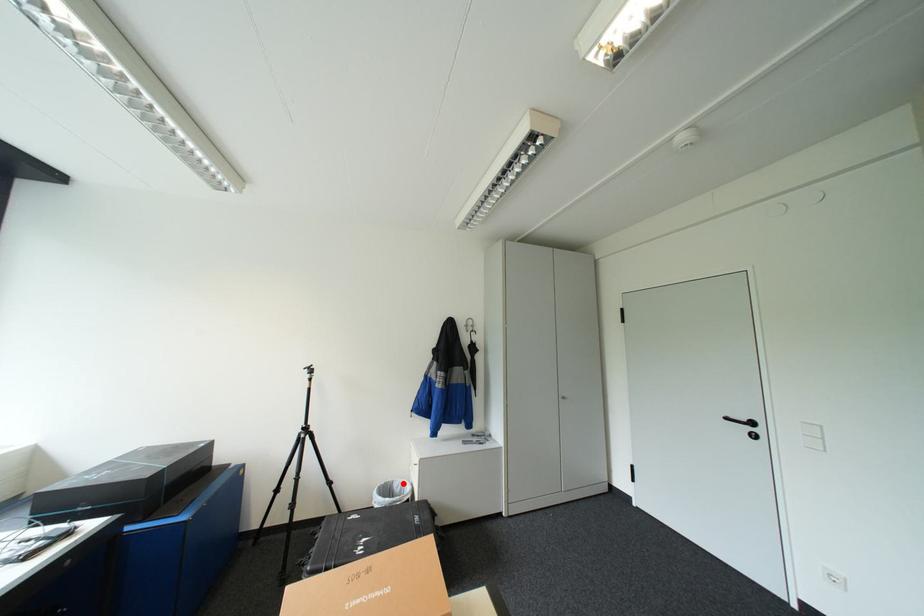
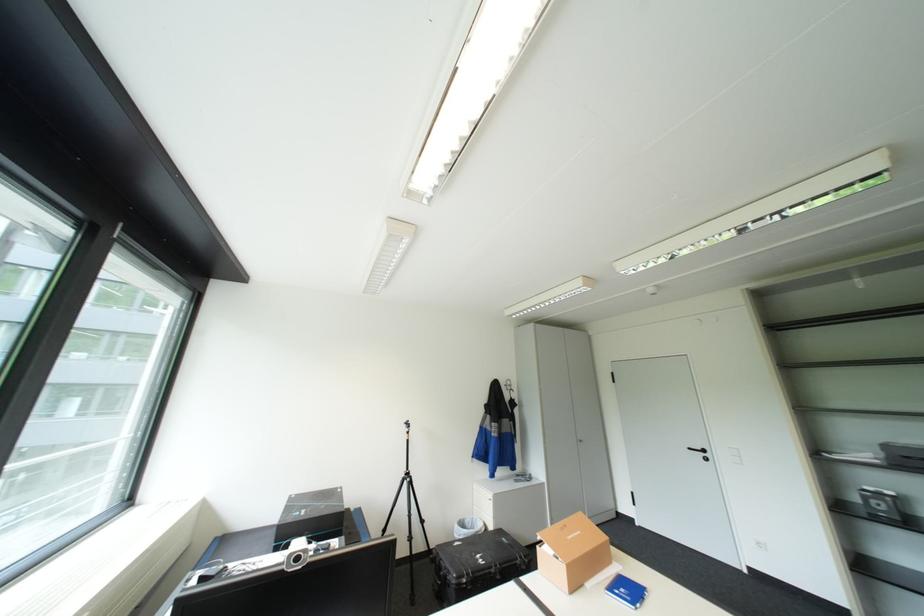
Locate, in the second image, the point that corresponds to the highlighted location in the first image.

(475, 521)